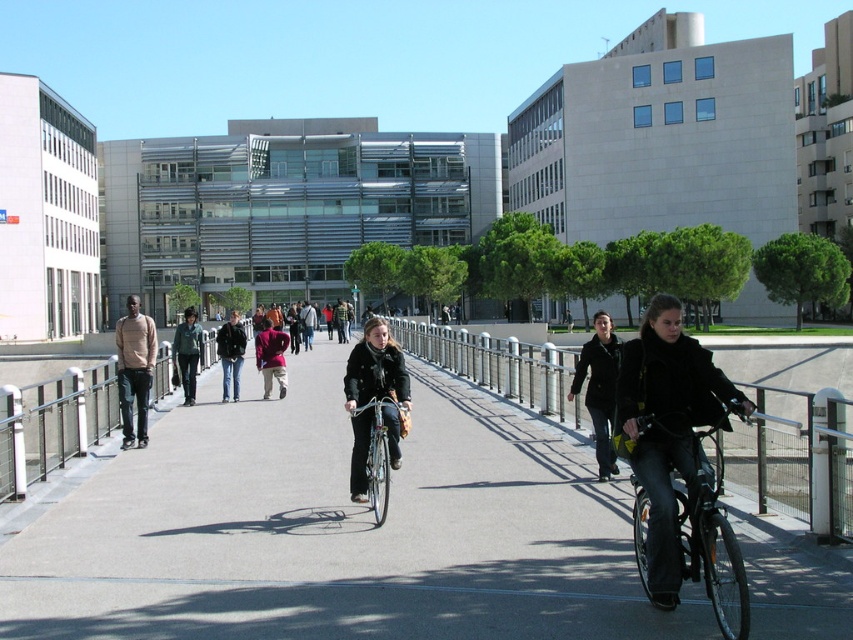
Who is more distant from viewer, (762, 426) or (131, 308)?

Positioned behind is point (131, 308).

Which is more to the left, metallic silver railing at center or light brown sweater at left?

light brown sweater at left is more to the left.

Between point (498, 337) and point (146, 324), which one is positioned in front?

Point (146, 324) is in front.

The height and width of the screenshot is (640, 853). Identify the location of metallic silver railing at center. (500, 365).

Between concrete pavement at center and silver metallic bicycle at center, which one is positioned lower?

Positioned lower is concrete pavement at center.

Where is `concrete pavement at center`? The height and width of the screenshot is (640, 853). concrete pavement at center is located at coordinates 339,531.

Is point (428, 376) positioned after point (378, 403)?

Yes, it is behind point (378, 403).

This screenshot has height=640, width=853. I want to click on concrete pavement at center, so click(339, 531).

Based on the photo, who is positioned more to the left, metallic silver railing at center or shiny black bicycle at center?

shiny black bicycle at center

Between metallic silver railing at center and shiny black bicycle at center, which one appears on the right side from the viewer's perspective?

metallic silver railing at center is more to the right.

Is point (492, 340) in front of point (701, 483)?

That is False.

Locate an element on the screen. Image resolution: width=853 pixels, height=640 pixels. metallic silver railing at center is located at coordinates (500, 365).